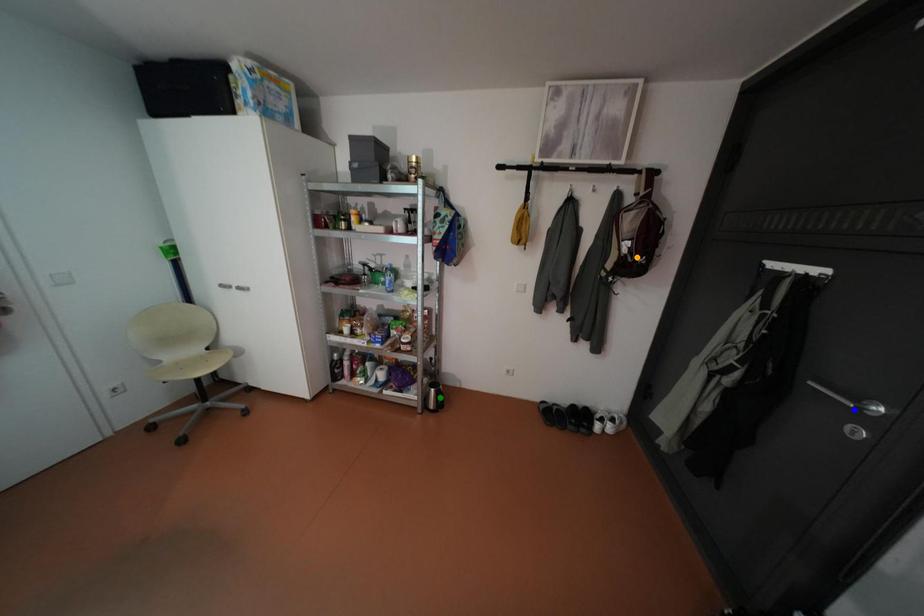
Order these from nearest to farthest:
green point | orange point | blue point

blue point → orange point → green point